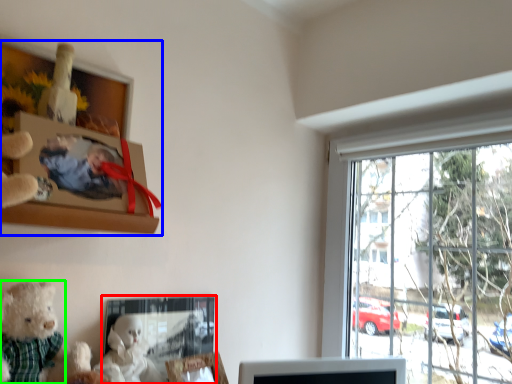
Question: Considering the real-world distances, which object is farthest from picture frame (highlighted by a red box)? picture frame (highlighted by a blue box) or teddy bear (highlighted by a green box)?

Choices:
 (A) picture frame
 (B) teddy bear

Answer: (A)